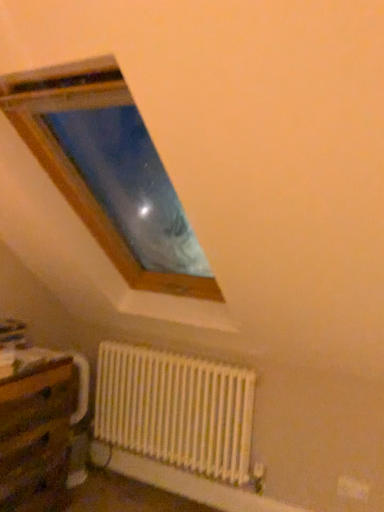
Question: Based on their positions, is white matte radiator at lower center located to the left or right of wooden table at lower left?

Choices:
 (A) right
 (B) left

Answer: (A)

Question: Is point (228, 371) positioned closer to the camera than point (3, 403)?

Choices:
 (A) farther
 (B) closer

Answer: (A)

Question: Considering the positions of white matte radiator at lower center and wooden table at lower left in the image, is white matte radiator at lower center bigger or smaller than wooden table at lower left?

Choices:
 (A) small
 (B) big

Answer: (A)

Question: Is wooden table at lower left bigger or smaller than white matte radiator at lower center?

Choices:
 (A) small
 (B) big

Answer: (B)

Question: Does point (6, 481) appear closer or farther from the camera than point (241, 382)?

Choices:
 (A) farther
 (B) closer

Answer: (B)

Question: Which is correct: wooden table at lower left is inside white matte radiator at lower center, or outside of it?

Choices:
 (A) outside
 (B) inside

Answer: (A)

Question: From the image's perspective, is wooden table at lower left located above or below white matte radiator at lower center?

Choices:
 (A) above
 (B) below

Answer: (B)